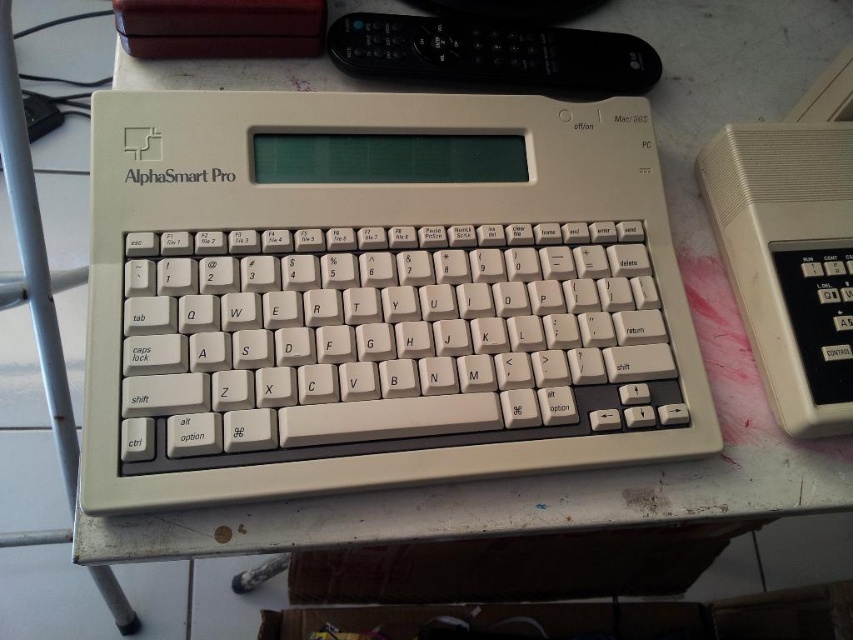
You are trying to place both the beige plastic calculator at right and the black plastic remote at upper center into a narrow drawer. Which item will fit better in the drawer if the drawer can only accommodate items narrower than the other?

The beige plastic calculator at right has a lesser width compared to the black plastic remote at upper center, so it will fit better in the drawer.